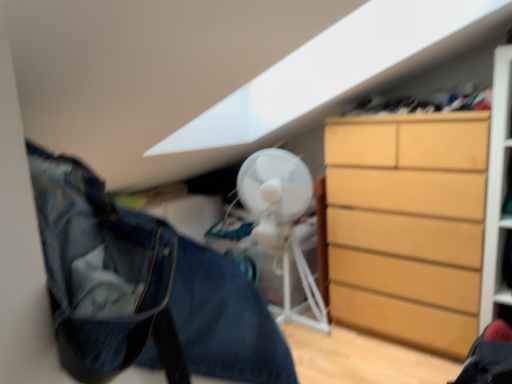
Question: Is white plastic mechanical fan at center surrounded by light brown wooden chest of drawers at right?

Choices:
 (A) yes
 (B) no

Answer: (B)

Question: From the image's perspective, is light brown wooden chest of drawers at right under white plastic mechanical fan at center?

Choices:
 (A) no
 (B) yes

Answer: (A)

Question: Is light brown wooden chest of drawers at right not within white plastic mechanical fan at center?

Choices:
 (A) no
 (B) yes

Answer: (B)

Question: Does light brown wooden chest of drawers at right have a greater height compared to white plastic mechanical fan at center?

Choices:
 (A) no
 (B) yes

Answer: (B)

Question: Is light brown wooden chest of drawers at right next to white plastic mechanical fan at center and touching it?

Choices:
 (A) yes
 (B) no

Answer: (B)

Question: Are light brown wooden chest of drawers at right and white plastic mechanical fan at center far apart?

Choices:
 (A) no
 (B) yes

Answer: (A)

Question: Is denim jacket at lower left far away from white plastic mechanical fan at center?

Choices:
 (A) yes
 (B) no

Answer: (A)

Question: Can you confirm if denim jacket at lower left is positioned to the right of white plastic mechanical fan at center?

Choices:
 (A) yes
 (B) no

Answer: (B)

Question: Considering the relative positions of denim jacket at lower left and white plastic mechanical fan at center in the image provided, is denim jacket at lower left to the left of white plastic mechanical fan at center from the viewer's perspective?

Choices:
 (A) no
 (B) yes

Answer: (B)

Question: From a real-world perspective, is denim jacket at lower left on white plastic mechanical fan at center?

Choices:
 (A) no
 (B) yes

Answer: (B)

Question: Can you confirm if denim jacket at lower left is smaller than white plastic mechanical fan at center?

Choices:
 (A) yes
 (B) no

Answer: (A)

Question: Is denim jacket at lower left looking in the opposite direction of white plastic mechanical fan at center?

Choices:
 (A) no
 (B) yes

Answer: (A)

Question: From a real-world perspective, is denim jacket at lower left positioned over light brown wooden chest of drawers at right based on gravity?

Choices:
 (A) yes
 (B) no

Answer: (A)